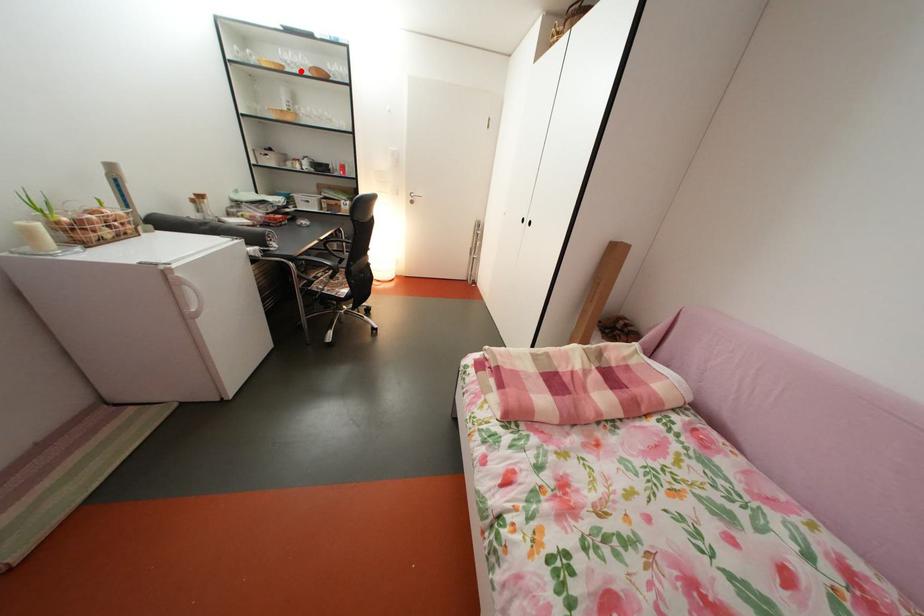
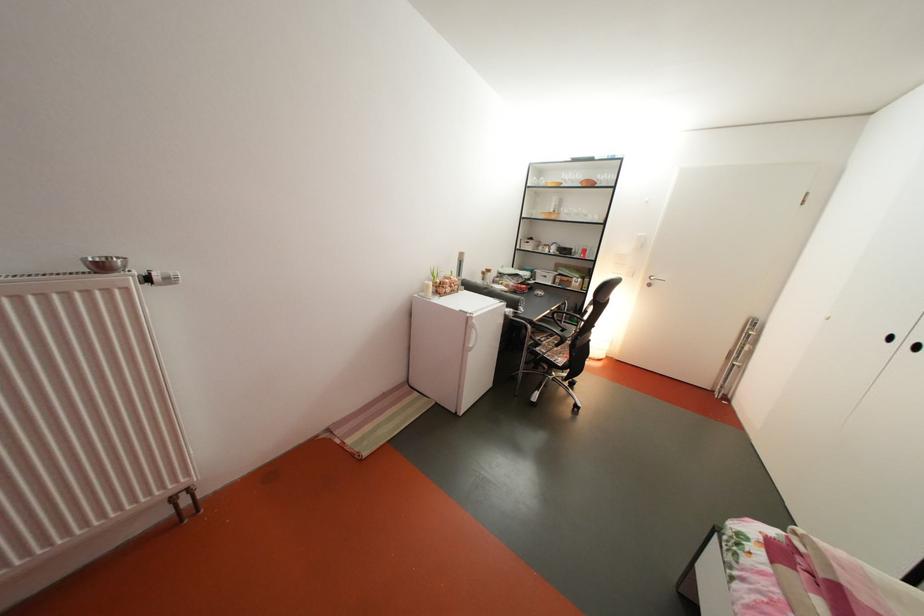
Question: I am providing you with two images of the same scene from different viewpoints. A red point is shown in image1. For the corresponding object point in image2, is it positioned nearer or farther from the camera?

Choices:
 (A) Nearer
 (B) Farther

Answer: (A)